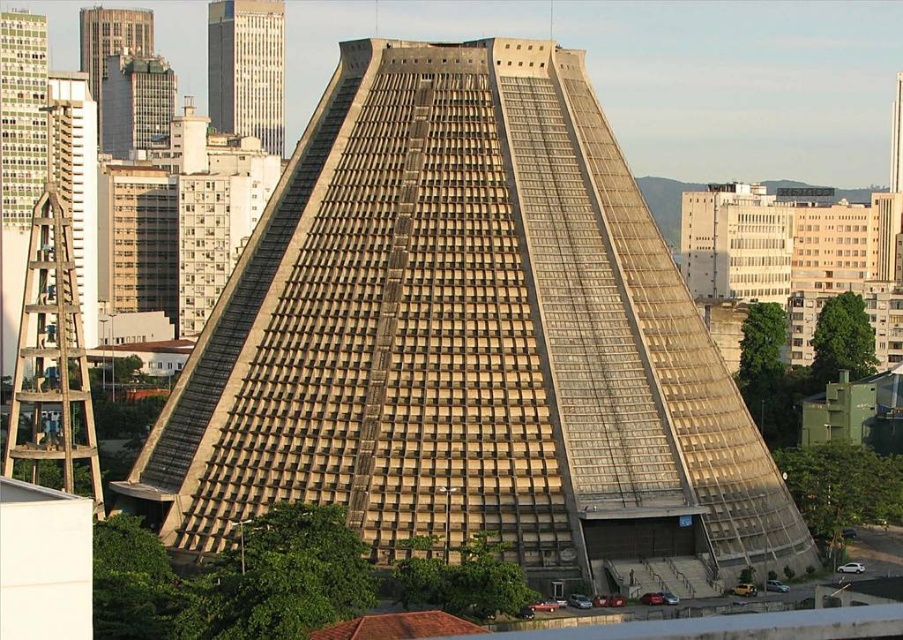
You are standing in front of the beige concrete pyramid at center and want to take a photo of the smooth glass skyscraper at upper left. In which direction should you move to frame both structures in your camera viewfinder?

You should move to the left to frame both the beige concrete pyramid at center and the smooth glass skyscraper at upper left in your camera viewfinder since the beige concrete pyramid at center is to the right of the smooth glass skyscraper at upper left.

You are standing in front of the Metropolitan Cathedral of Brasilia, and you notice a specific point marked at coordinates [468,342]. Based on the beige concrete pyramid at the center of the cathedral, where exactly is this point located?

The point at [468,342] is located on the beige concrete pyramid at center.

You are an architect planning to install a new light pole between the beige concrete pyramid at center and the metallic glass skyscraper at upper left. The light pole requires a minimum of 500 feet of space between the two structures to function properly. Based on the given distance, will the light pole installation be feasible?

The beige concrete pyramid at center and metallic glass skyscraper at upper left are 624.64 feet apart, which exceeds the required 500 feet. Therefore, the light pole installation is feasible as there is sufficient space between them.